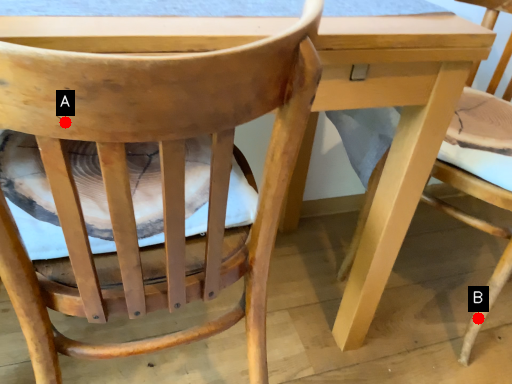
Question: Two points are circled on the image, labeled by A and B beside each circle. Which point is farther from the camera taking this photo?

Choices:
 (A) A is further
 (B) B is further

Answer: (B)